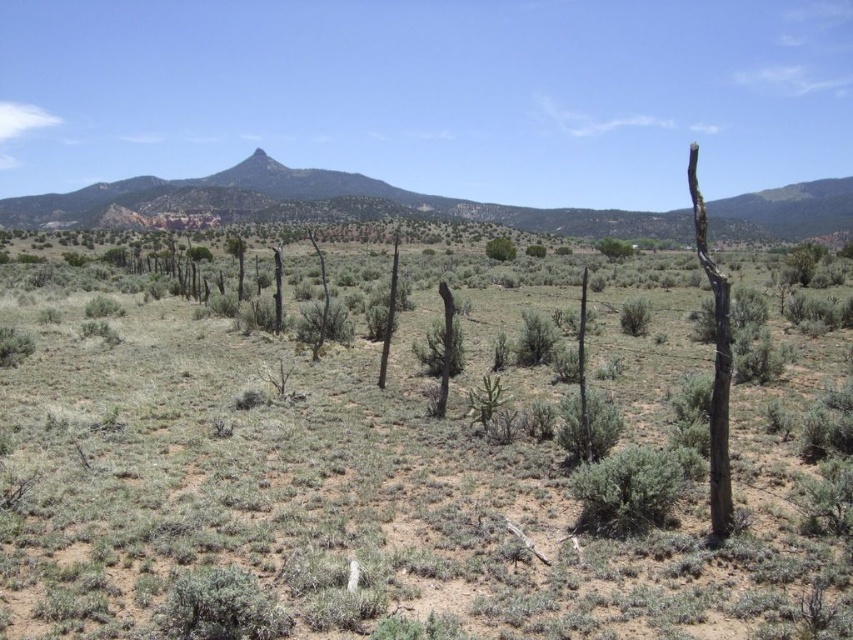
Which is below, green shrubs at center or green leafy bush at center?

green shrubs at center is below.

Is green shrubs at center bigger than green leafy bush at center?

Indeed, green shrubs at center has a larger size compared to green leafy bush at center.

From the picture: Measure the distance between point (618, 620) and camera.

6.22 meters

Locate an element on the screen. The image size is (853, 640). green shrubs at center is located at coordinates (389, 483).

Is green shrubs at center further to camera compared to green shrub at center?

No, it is in front of green shrub at center.

Who is positioned more to the right, green shrubs at center or green shrub at center?

green shrub at center is more to the right.

This screenshot has height=640, width=853. I want to click on green shrubs at center, so coord(389,483).

In the scene shown: Is brown rough tree trunk at right further to camera compared to green leafy bush at center?

No, it is not.

Who is more forward, [714,400] or [489,241]?

Point [714,400]

Locate an element on the screen. brown rough tree trunk at right is located at coordinates (715, 365).